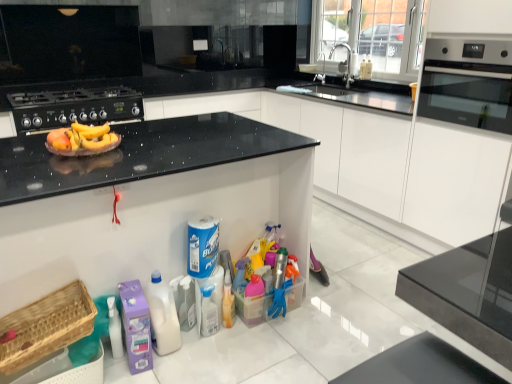
What do you see at coordinates (46, 326) in the screenshot? I see `woven wood basket at lower left` at bounding box center [46, 326].

This screenshot has height=384, width=512. What do you see at coordinates (136, 326) in the screenshot?
I see `purple plastic laundry detergent at lower left, the first cleaning product when ordered from left to right` at bounding box center [136, 326].

How much space does purple plastic laundry detergent at lower left, which is the 3th cleaning product in right-to-left order, occupy vertically?

purple plastic laundry detergent at lower left, which is the 3th cleaning product in right-to-left order, is 12.99 inches in height.

The height and width of the screenshot is (384, 512). What do you see at coordinates (321, 73) in the screenshot?
I see `silver metallic faucet at upper center, acting as the 2th faucet starting from the front` at bounding box center [321, 73].

Find the location of a particular element. silver metallic faucet at upper center, marked as the first faucet in a back-to-front arrangement is located at coordinates (321, 73).

At what (x,y) coordinates should I click in order to perform the action: click on transparent glass door at upper center. Please return your answer as a coordinate pair (x, y). Looking at the image, I should click on (370, 36).

Where is `woven wood basket at lower left`? Image resolution: width=512 pixels, height=384 pixels. woven wood basket at lower left is located at coordinates (46, 326).

Considering the sizes of objects yellow matte bananas at center and white glossy cabinet at upper center in the image provided, who is shorter, yellow matte bananas at center or white glossy cabinet at upper center?

yellow matte bananas at center.

Could you tell me if yellow matte bananas at center is facing white glossy cabinet at upper center?

No, yellow matte bananas at center is not aimed at white glossy cabinet at upper center.

Is the position of yellow matte bananas at center less distant than that of white glossy cabinet at upper center?

Yes, yellow matte bananas at center is in front of white glossy cabinet at upper center.

From a real-world perspective, is white plastic bottle at lower center, positioned as the second cleaning product in right-to-left order, positioned above or below polished stainless steel faucet at upper right, the 2th faucet from the back?

white plastic bottle at lower center, positioned as the second cleaning product in right-to-left order, is situated lower than polished stainless steel faucet at upper right, the 2th faucet from the back, in the real world.

What are the coordinates of `the 2nd cleaning product in front of the polished stainless steel faucet at upper right, the first faucet viewed from the front` in the screenshot? It's located at (162, 316).

From their relative heights in the image, would you say white plastic bottle at lower center, positioned as the second cleaning product in right-to-left order, is taller or shorter than polished stainless steel faucet at upper right, the first faucet viewed from the front?

Considering their sizes, white plastic bottle at lower center, positioned as the second cleaning product in right-to-left order, has more height than polished stainless steel faucet at upper right, the first faucet viewed from the front.

Between white plastic bottle at lower center, positioned as the second cleaning product in right-to-left order, and polished stainless steel faucet at upper right, the 2th faucet from the back, which one appears on the right side from the viewer's perspective?

From the viewer's perspective, polished stainless steel faucet at upper right, the 2th faucet from the back, appears more on the right side.

Is point (15, 333) closer or farther from the camera than point (339, 26)?

Point (15, 333) is closer to the camera than point (339, 26).

Is woven wood basket at lower left not inside transparent glass door at upper center?

Yes, woven wood basket at lower left is located beyond the bounds of transparent glass door at upper center.

From a real-world perspective, is woven wood basket at lower left positioned above or below transparent glass door at upper center?

From a real-world perspective, woven wood basket at lower left is physically below transparent glass door at upper center.

From a real-world perspective, which is physically above, black matte gas stove at upper left or polished stainless steel faucet at upper right, the first faucet viewed from the front?

polished stainless steel faucet at upper right, the first faucet viewed from the front.

Would you say black matte gas stove at upper left is a long distance from polished stainless steel faucet at upper right, the first faucet viewed from the front?

Yes, black matte gas stove at upper left is far from polished stainless steel faucet at upper right, the first faucet viewed from the front.

Is black matte gas stove at upper left bigger or smaller than polished stainless steel faucet at upper right, the first faucet viewed from the front?

Clearly, black matte gas stove at upper left is larger in size than polished stainless steel faucet at upper right, the first faucet viewed from the front.

From the picture: Which point is more distant from viewer, (101, 104) or (339, 67)?

Positioned behind is point (339, 67).

Where is `kitchen appliance in front of the silver metallic faucet at upper center, marked as the first faucet in a back-to-front arrangement`? The width and height of the screenshot is (512, 384). kitchen appliance in front of the silver metallic faucet at upper center, marked as the first faucet in a back-to-front arrangement is located at coordinates (74, 107).

Which object is more forward, silver metallic faucet at upper center, acting as the 2th faucet starting from the front, or black matte gas stove at upper left?

black matte gas stove at upper left is more forward.

Is silver metallic faucet at upper center, acting as the 2th faucet starting from the front, with black matte gas stove at upper left?

silver metallic faucet at upper center, acting as the 2th faucet starting from the front, and black matte gas stove at upper left are not in contact.

Which of these two, silver metallic faucet at upper center, acting as the 2th faucet starting from the front, or black matte gas stove at upper left, is wider?

black matte gas stove at upper left is wider.

The image size is (512, 384). Identify the location of glass door in front of the silver metallic faucet at upper center, marked as the first faucet in a back-to-front arrangement. (370, 36).

Considering the sizes of objects transparent glass door at upper center and silver metallic faucet at upper center, marked as the first faucet in a back-to-front arrangement, in the image provided, who is shorter, transparent glass door at upper center or silver metallic faucet at upper center, marked as the first faucet in a back-to-front arrangement,?

silver metallic faucet at upper center, marked as the first faucet in a back-to-front arrangement, is shorter.

Could you tell me if transparent glass door at upper center is facing silver metallic faucet at upper center, acting as the 2th faucet starting from the front?

Yes, transparent glass door at upper center is turned towards silver metallic faucet at upper center, acting as the 2th faucet starting from the front.

Consider the image. Are white glossy cabinet at upper center and white plastic bottle at lower center, the second cleaning product viewed from the left, making contact?

No, white glossy cabinet at upper center is not next to white plastic bottle at lower center, the second cleaning product viewed from the left.

You are a GUI agent. You are given a task and a screenshot of the screen. Output one action in this format:
    pyautogui.click(x=<x>, y=<y>)
    Task: Click on the 2nd cleaning product below the white glossy cabinet at upper center (from the image's perspective)
    This screenshot has width=512, height=384.
    Given the screenshot: What is the action you would take?
    pyautogui.click(x=162, y=316)

Can you confirm if white glossy cabinet at upper center is positioned to the left of white plastic bottle at lower center, positioned as the second cleaning product in right-to-left order?

Incorrect, white glossy cabinet at upper center is not on the left side of white plastic bottle at lower center, positioned as the second cleaning product in right-to-left order.

From a real-world perspective, which object rests below the other?

white plastic bottle at lower center, the second cleaning product viewed from the left.

At what (x,y) coordinates should I click in order to perform the action: click on cabinetry to the right of yellow matte bananas at center. Please return your answer as a coordinate pair (x, y). Image resolution: width=512 pixels, height=384 pixels. Looking at the image, I should click on (348, 149).

Identify the location of the 1st faucet above the white plastic bottle at lower center, positioned as the second cleaning product in right-to-left order (from the image's perspective). (344, 63).

In the scene shown: When comparing their distances from polished stainless steel faucet at upper right, the 2th faucet from the back, does transparent glass door at upper center or black glass oven at right seem closer?

Among the two, transparent glass door at upper center is located nearer to polished stainless steel faucet at upper right, the 2th faucet from the back.

Based on their spatial positions, is white glossy cabinet at upper center or black matte gas stove at upper left closer to black granite countertop at center?

black matte gas stove at upper left lies closer to black granite countertop at center than the other object.

Based on their spatial positions, is yellow matte bananas at center or white glossy cabinet at upper center closer to woven wood basket at lower left?

yellow matte bananas at center.

Which object lies nearer to the anchor point translucent plastic spray bottle at center, transparent glass door at upper center or yellow matte bananas at center?

yellow matte bananas at center is positioned closer to the anchor translucent plastic spray bottle at center.

When comparing their distances from blue paper towel at center, which ranks as the first cleaning product in right-to-left order, does white glossy cabinet at upper center or woven wood basket at lower left seem closer?

Among the two, woven wood basket at lower left is located nearer to blue paper towel at center, which ranks as the first cleaning product in right-to-left order.

Based on their spatial positions, is white plastic bottle at lower center, positioned as the second cleaning product in right-to-left order, or polished stainless steel faucet at upper right, the 2th faucet from the back, closer to silver metallic faucet at upper center, acting as the 2th faucet starting from the front?

polished stainless steel faucet at upper right, the 2th faucet from the back, is closer to silver metallic faucet at upper center, acting as the 2th faucet starting from the front.

Looking at the image, which one is located closer to blue paper towel at center, which ranks as the first cleaning product in right-to-left order, translucent plastic spray bottle at center or yellow matte bananas at center?

Among the two, translucent plastic spray bottle at center is located nearer to blue paper towel at center, which ranks as the first cleaning product in right-to-left order.

When comparing their distances from white plastic bottle at lower center, the second cleaning product viewed from the left, does yellow matte bananas at center or white glossy cabinet at upper center seem further?

Among the two, white glossy cabinet at upper center is located further to white plastic bottle at lower center, the second cleaning product viewed from the left.

Locate an element on the screen. banana between black granite countertop at center and transparent glass door at upper center in the front-back direction is located at coordinates (82, 138).

You are a GUI agent. You are given a task and a screenshot of the screen. Output one action in this format:
    pyautogui.click(x=<x>, y=<y>)
    Task: Click on the cabinetry between transparent glass door at upper center and purple plastic laundry detergent at lower left, the first cleaning product when ordered from left to right, from top to bottom
    This screenshot has width=512, height=384.
    Given the screenshot: What is the action you would take?
    pyautogui.click(x=348, y=149)

Identify the location of bottle between black granite countertop at center and silver metallic faucet at upper center, acting as the 2th faucet starting from the front, from front to back. Image resolution: width=512 pixels, height=384 pixels. (208, 311).

You are a GUI agent. You are given a task and a screenshot of the screen. Output one action in this format:
    pyautogui.click(x=<x>, y=<y>)
    Task: Click on the cleaning product between transparent glass door at upper center and woven wood basket at lower left in the up-down direction
    This screenshot has width=512, height=384.
    Given the screenshot: What is the action you would take?
    pyautogui.click(x=202, y=246)